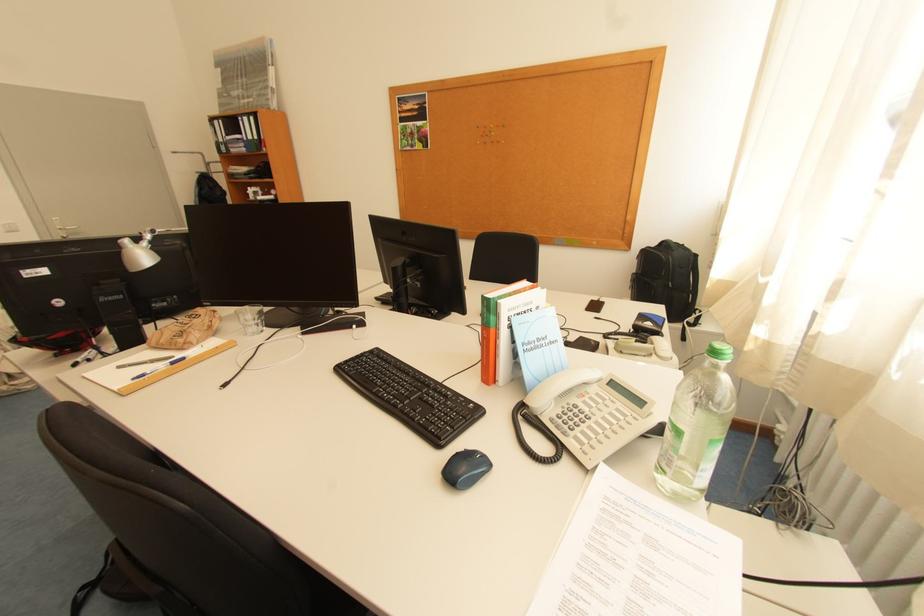
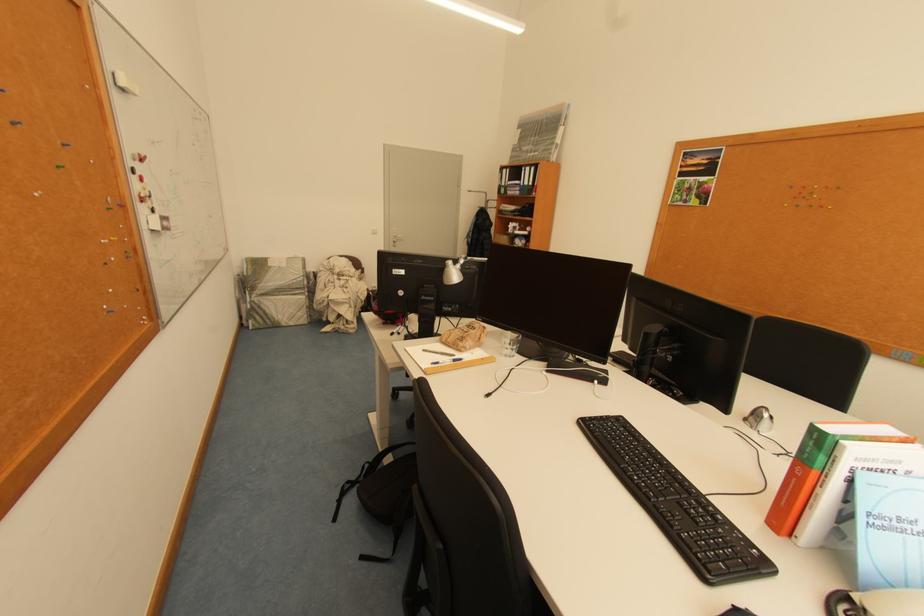
Where in the second image is the point corresponding to [365,358] from the first image?

(610, 419)